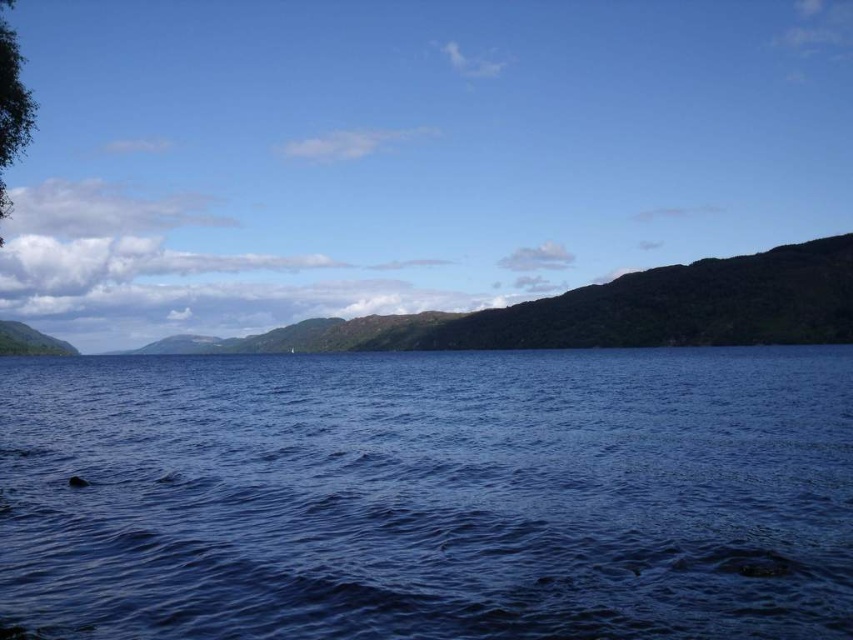
What do you see at coordinates (619, 310) in the screenshot? This screenshot has width=853, height=640. I see `green textured hillside at center` at bounding box center [619, 310].

Describe the element at coordinates (619, 310) in the screenshot. I see `green textured hillside at center` at that location.

Image resolution: width=853 pixels, height=640 pixels. I want to click on green textured hillside at center, so click(x=619, y=310).

The height and width of the screenshot is (640, 853). I want to click on blue liquid water at center, so click(430, 496).

Between blue liquid water at center and green textured hillside at center, which one has less height?

With less height is blue liquid water at center.

Who is more distant from viewer, (297, 566) or (795, 298)?

The point (795, 298) is more distant.

Where is `blue liquid water at center`? Image resolution: width=853 pixels, height=640 pixels. blue liquid water at center is located at coordinates (430, 496).

Consider the image. Who is lower down, blue liquid water at center or green leafy tree at upper left?

blue liquid water at center

Consider the image. Which is above, blue liquid water at center or green leafy tree at upper left?

green leafy tree at upper left

In the scene shown: Who is more distant from viewer, (300,412) or (4,136)?

The point (300,412) is more distant.

Find the location of a particular element. Image resolution: width=853 pixels, height=640 pixels. blue liquid water at center is located at coordinates (430, 496).